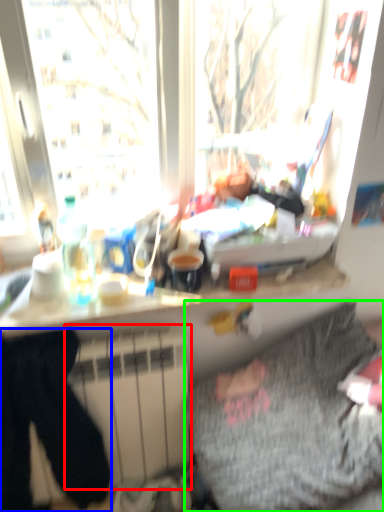
Question: Which is nearer to the radiator (highlighted by a red box)? sweat pant (highlighted by a blue box) or bedding (highlighted by a green box).

Choices:
 (A) sweat pant
 (B) bedding

Answer: (A)